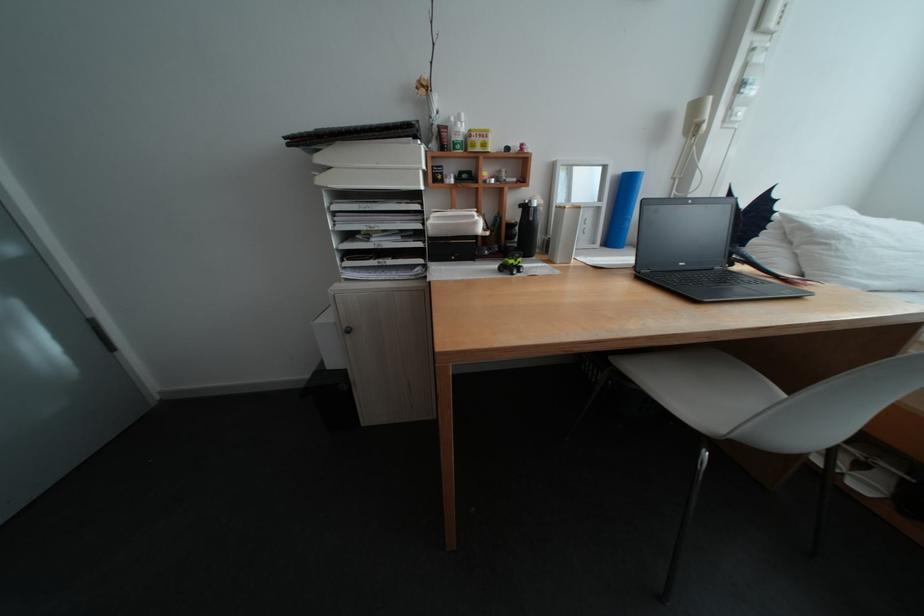
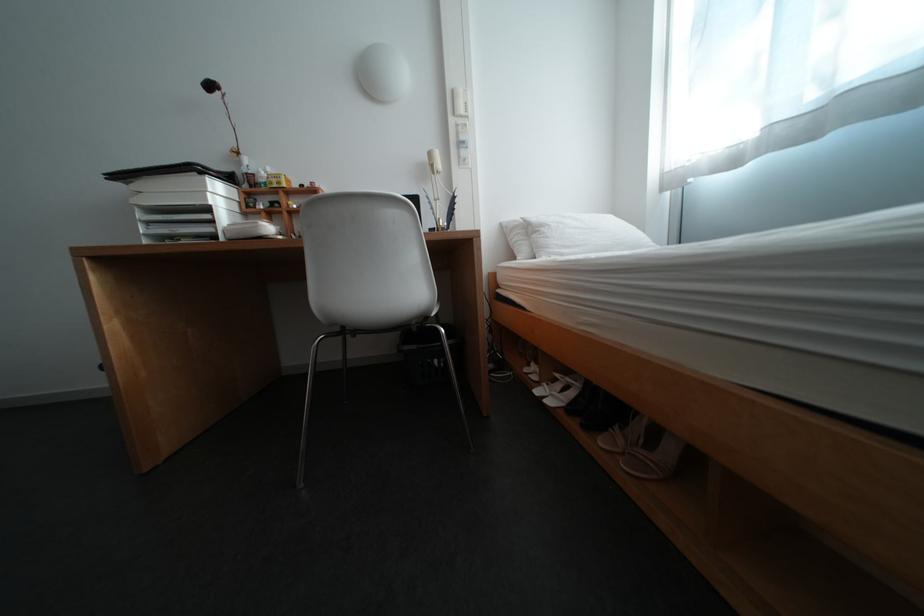
Question: What movement of the cameraman would produce the second image?

Choices:
 (A) Left
 (B) Right
 (C) Forward
 (D) Backward

Answer: (B)